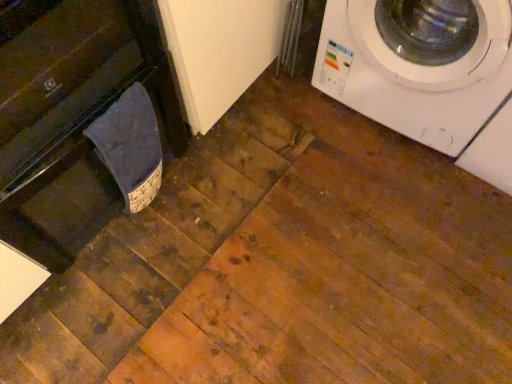
Question: Considering the relative sizes of white glossy washing machine at upper right and black glossy dishwasher at left in the image provided, is white glossy washing machine at upper right taller than black glossy dishwasher at left?

Choices:
 (A) yes
 (B) no

Answer: (B)

Question: Considering the relative sizes of white glossy washing machine at upper right and black glossy dishwasher at left in the image provided, is white glossy washing machine at upper right wider than black glossy dishwasher at left?

Choices:
 (A) yes
 (B) no

Answer: (B)

Question: Is black glossy dishwasher at left inside white glossy washing machine at upper right?

Choices:
 (A) no
 (B) yes

Answer: (A)

Question: Is white glossy washing machine at upper right not inside black glossy dishwasher at left?

Choices:
 (A) yes
 (B) no

Answer: (A)

Question: From a real-world perspective, is white glossy washing machine at upper right under black glossy dishwasher at left?

Choices:
 (A) no
 (B) yes

Answer: (B)

Question: From their relative heights in the image, would you say dark blue fabric at lower left is taller or shorter than black glossy dishwasher at left?

Choices:
 (A) tall
 (B) short

Answer: (B)

Question: In the image, is dark blue fabric at lower left on the left side or the right side of black glossy dishwasher at left?

Choices:
 (A) left
 (B) right

Answer: (B)

Question: From a real-world perspective, is dark blue fabric at lower left physically located above or below black glossy dishwasher at left?

Choices:
 (A) below
 (B) above

Answer: (A)

Question: Do you think dark blue fabric at lower left is within black glossy dishwasher at left, or outside of it?

Choices:
 (A) outside
 (B) inside

Answer: (B)

Question: From their relative heights in the image, would you say white glossy washing machine at upper right is taller or shorter than dark blue fabric at lower left?

Choices:
 (A) short
 (B) tall

Answer: (B)

Question: From a real-world perspective, is white glossy washing machine at upper right physically located above or below dark blue fabric at lower left?

Choices:
 (A) below
 (B) above

Answer: (B)

Question: In terms of size, does white glossy washing machine at upper right appear bigger or smaller than dark blue fabric at lower left?

Choices:
 (A) big
 (B) small

Answer: (A)

Question: Relative to dark blue fabric at lower left, is white glossy washing machine at upper right in front or behind?

Choices:
 (A) front
 (B) behind

Answer: (A)

Question: From the image's perspective, is dark blue fabric at lower left positioned above or below white glossy washing machine at upper right?

Choices:
 (A) below
 (B) above

Answer: (A)

Question: Is point (144, 96) closer or farther from the camera than point (385, 69)?

Choices:
 (A) closer
 (B) farther

Answer: (A)